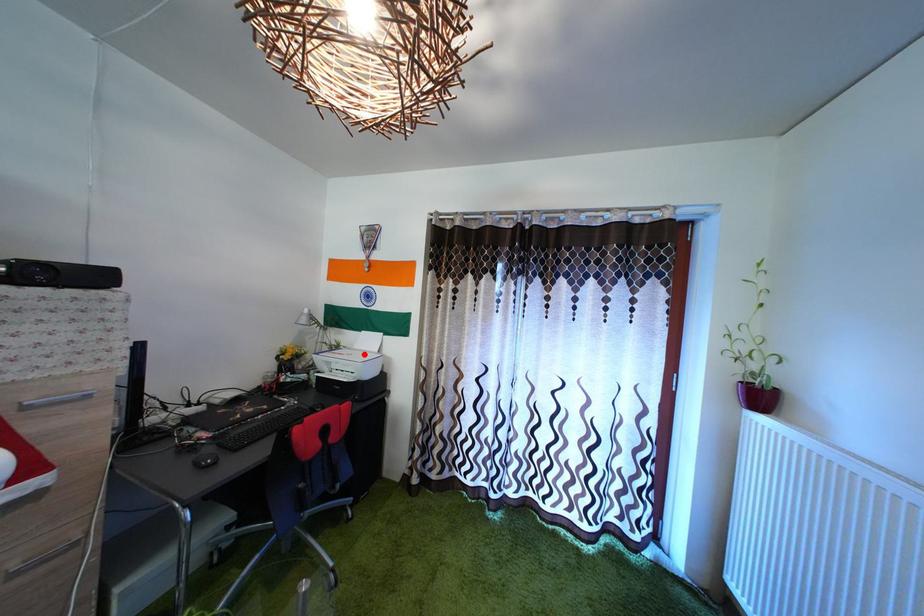
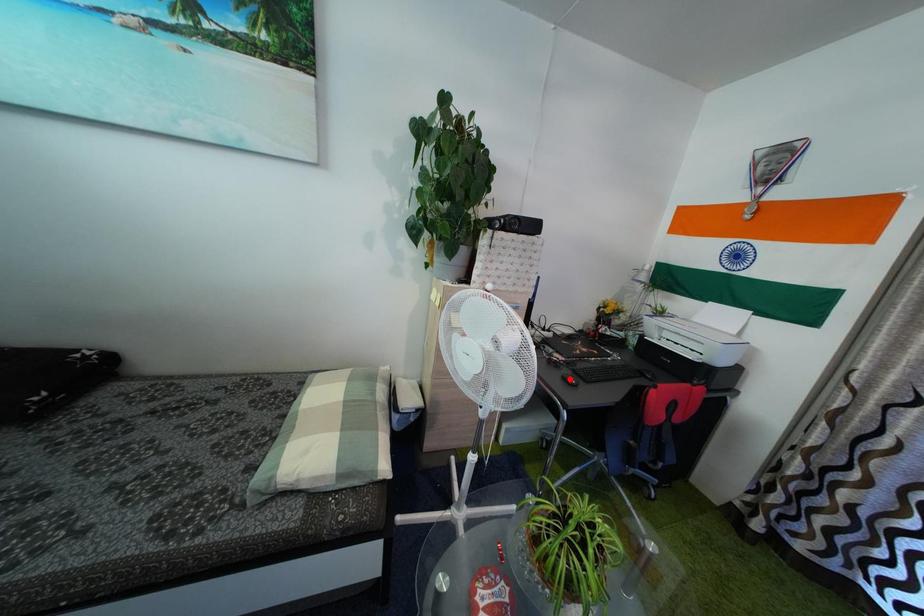
I am providing you with two images of the same scene from different viewpoints. A red point is marked on the first image and another point is marked on the second image. Is the red point in image1 aligned with the point shown in image2?

No